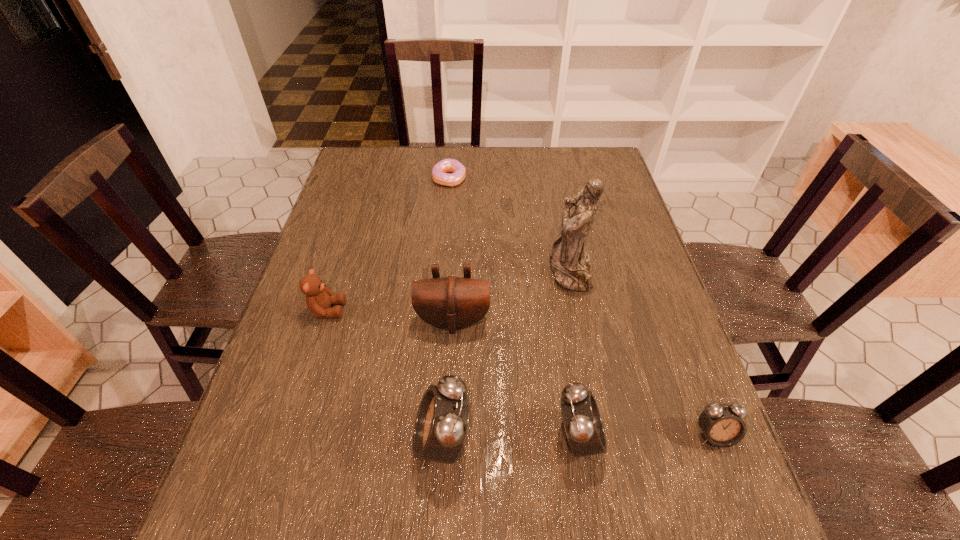
Identify the location of free space that satisfies the following two spatial constraints: 1. on the face of the second shortest object; 2. on the face of the second tallest alarm clock. Image resolution: width=960 pixels, height=540 pixels. (715, 438).

Locate an element on the screen. This screenshot has width=960, height=540. vacant point that satisfies the following two spatial constraints: 1. on the face of the rightmost alarm clock; 2. on the face of the leftmost alarm clock is located at coordinates (716, 441).

Identify the location of vacant region that satisfies the following two spatial constraints: 1. on the front-facing side of the second farthest object; 2. with the flap open on the pouch. This screenshot has height=540, width=960. (580, 321).

Where is `free point that satisfies the following two spatial constraints: 1. on the face of the rightmost object; 2. on the face of the leftmost alarm clock`? free point that satisfies the following two spatial constraints: 1. on the face of the rightmost object; 2. on the face of the leftmost alarm clock is located at coordinates (716, 441).